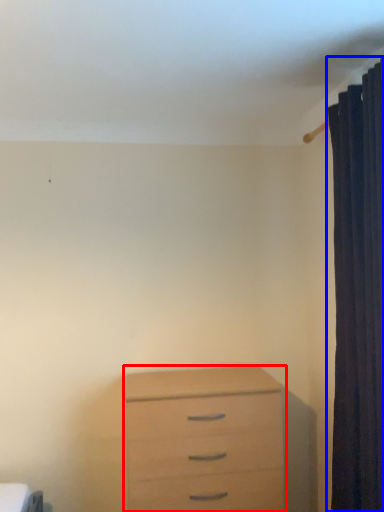
Question: Which object appears farthest to the camera in this image, chest of drawers (highlighted by a red box) or curtain (highlighted by a blue box)?

Choices:
 (A) chest of drawers
 (B) curtain

Answer: (A)